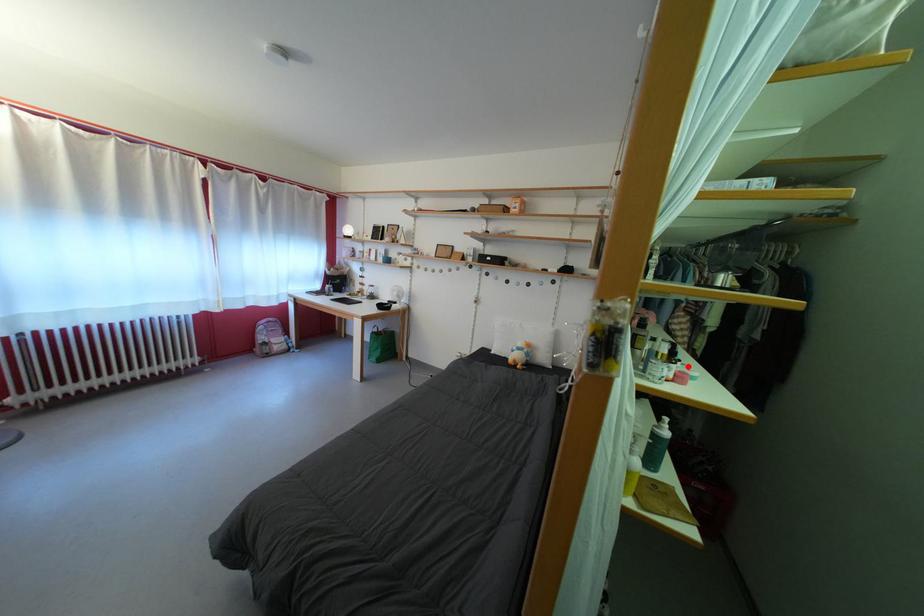
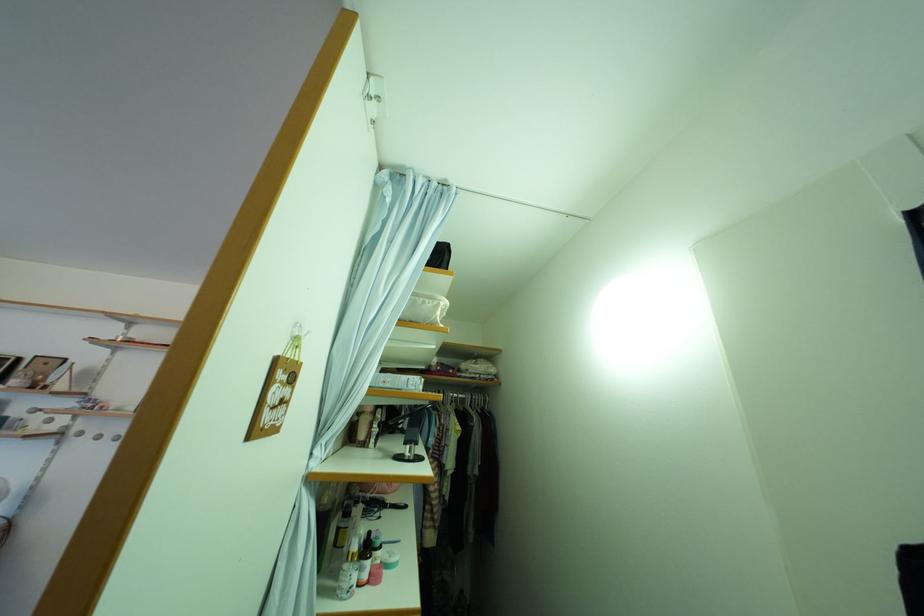
Where in the second image is the point corresponding to the highlighted location from the first image?

(390, 554)